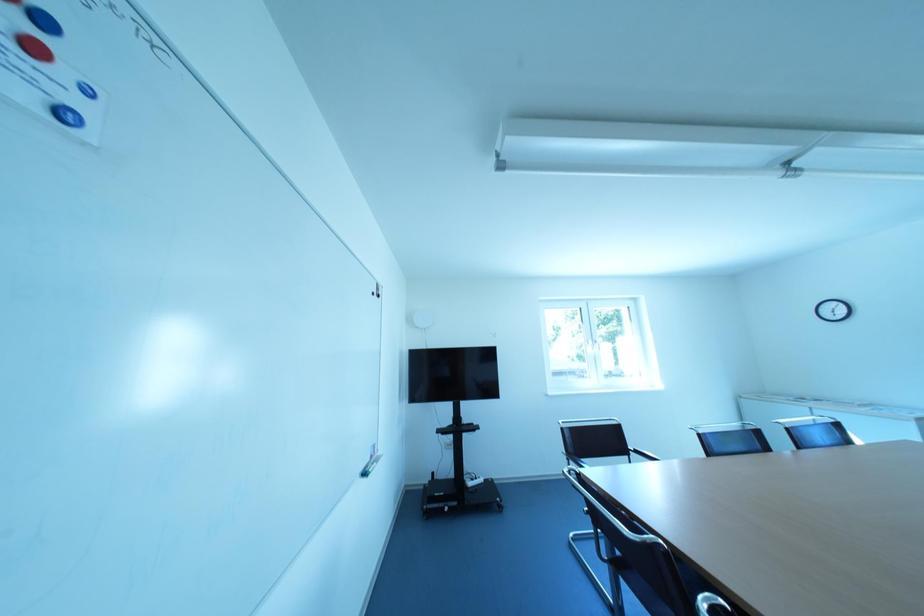
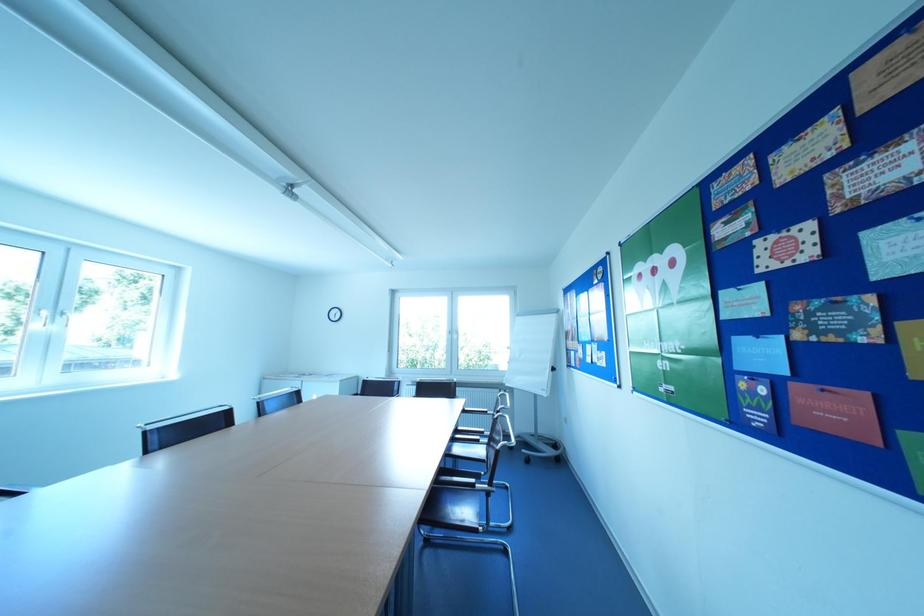
Question: How did the camera likely rotate?

Choices:
 (A) Left
 (B) Right
 (C) Up
 (D) Down

Answer: (B)